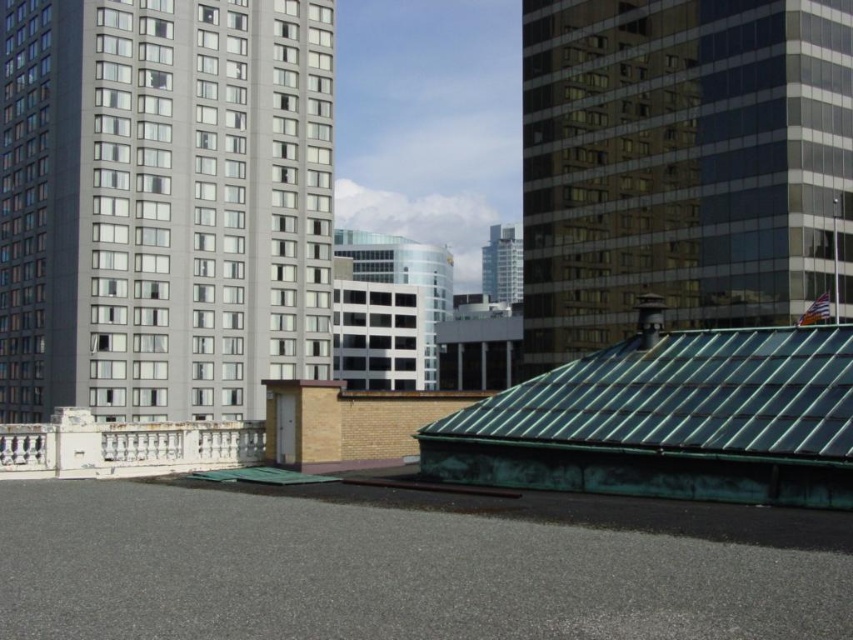
You are a drone operator who needs to fly a drone between the white glass building at center and the matte glass skyscraper at center. The drone has a maximum flight distance of 150 feet. Can the drone safely fly between them without exceeding its range?

The distance between the white glass building at center and the matte glass skyscraper at center is 182.93 feet, which exceeds the drone operator maximum flight distance of 150 feet. The drone cannot safely fly between them without exceeding its range.

You are a drone operator who needs to deliver a package from the gray concrete building at left to the green glass roof at upper right. The drone has a maximum range of 40 meters. Can the drone make the delivery without needing a recharge?

The gray concrete building at left and green glass roof at upper right are 39.81 meters apart. Since the drone has a maximum range of 40 meters, it can make the delivery without needing a recharge.

You are a drone operator trying to navigate between two structures on a rooftop. You need to fly your drone from the gray concrete building at left to the green glass roof at upper right. Based on their positions, will the drone have to fly upwards or downwards to reach its destination?

The gray concrete building at left is located above the green glass roof at upper right, so the drone will have to fly downwards to reach the green glass roof at upper right from the gray concrete building at left.